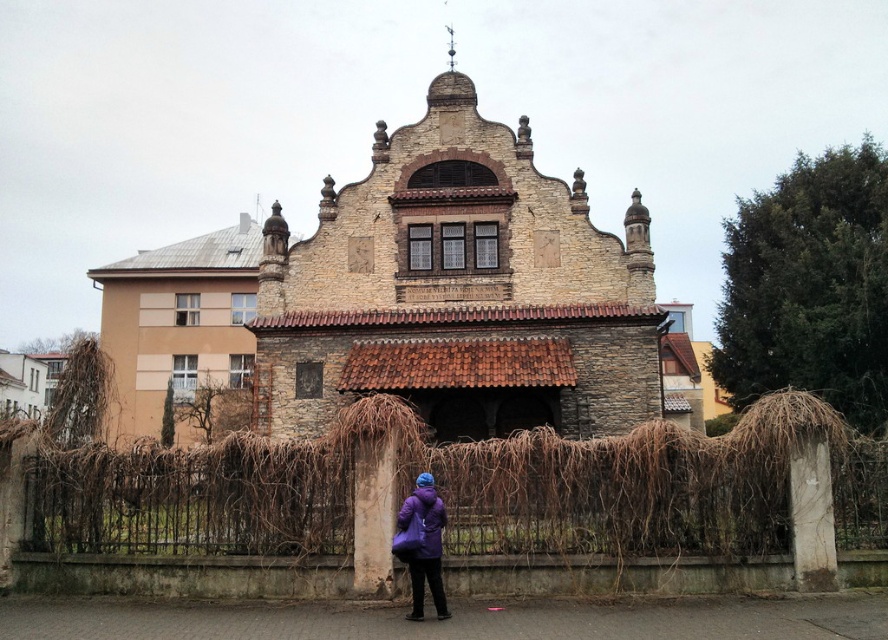
Who is positioned more to the left, purple matte jacket at lower center or purple synthetic coat at lower center?

purple synthetic coat at lower center

Is point (438, 579) positioned in front of point (430, 492)?

Yes, point (438, 579) is in front of point (430, 492).

I want to click on purple matte jacket at lower center, so click(x=423, y=545).

Which of these two, stone textured church at center or purple matte jacket at lower center, stands taller?

With more height is stone textured church at center.

Does stone textured church at center have a lesser width compared to purple matte jacket at lower center?

No, stone textured church at center is not thinner than purple matte jacket at lower center.

Locate an element on the screen. This screenshot has width=888, height=640. stone textured church at center is located at coordinates [x=458, y=291].

Between brown wicker fence at lower center and purple synthetic coat at lower center, which one appears on the right side from the viewer's perspective?

brown wicker fence at lower center is more to the right.

The width and height of the screenshot is (888, 640). In order to click on brown wicker fence at lower center in this screenshot , I will do `click(636, 502)`.

Which is behind, point (759, 449) or point (432, 496)?

The point (759, 449) is more distant.

At what (x,y) coordinates should I click in order to perform the action: click on brown wicker fence at lower center. Please return your answer as a coordinate pair (x, y). This screenshot has height=640, width=888. Looking at the image, I should click on (636, 502).